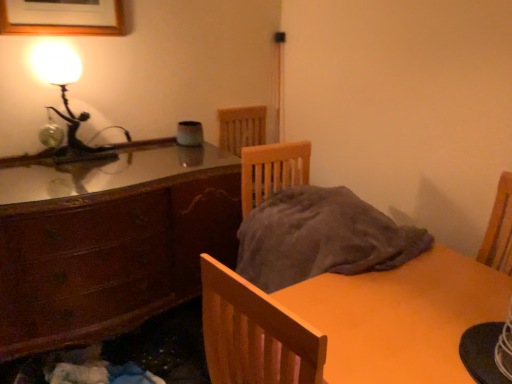
What is the approximate width of matte wooden table at lower right?

matte wooden table at lower right is 31.59 inches in width.

Locate an element on the screen. Image resolution: width=512 pixels, height=384 pixels. matte wooden table at lower right is located at coordinates (350, 323).

You are a GUI agent. You are given a task and a screenshot of the screen. Output one action in this format:
    pyautogui.click(x=<x>, y=<y>)
    Task: Click on the wooden picture frame at upper left
    
    Given the screenshot: What is the action you would take?
    pyautogui.click(x=64, y=18)

At what (x,y) coordinates should I click in order to perform the action: click on wooden cabinet at left. Please return your answer as a coordinate pair (x, y). This screenshot has height=384, width=512. Looking at the image, I should click on (109, 241).

Is matte wooden table at lower right taller than wooden picture frame at upper left?

Yes.

What's the angular difference between matte wooden table at lower right and wooden picture frame at upper left's facing directions?

The angle between the facing direction of matte wooden table at lower right and the facing direction of wooden picture frame at upper left is 89.1 degrees.

I want to click on picture frame above the matte wooden table at lower right (from the image's perspective), so coord(64,18).

Looking at this image, from the image's perspective, is matte glass lamp at upper left above or below wooden cabinet at left?

matte glass lamp at upper left is above wooden cabinet at left.

How much distance is there between matte glass lamp at upper left and wooden cabinet at left?

The distance of matte glass lamp at upper left from wooden cabinet at left is 17.94 inches.

Does point (54, 82) come behind point (194, 255)?

No, it is in front of (194, 255).

Is matte glass lamp at upper left thinner than wooden cabinet at left?

Yes.

Can wooden cabinet at left be found inside wooden picture frame at upper left?

No, wooden picture frame at upper left does not contain wooden cabinet at left.

From the image's perspective, is wooden picture frame at upper left located above or below wooden cabinet at left?

From the image's perspective, wooden picture frame at upper left appears above wooden cabinet at left.

Which object is positioned more to the left, wooden picture frame at upper left or wooden cabinet at left?

From the viewer's perspective, wooden picture frame at upper left appears more on the left side.

In terms of size, does matte glass lamp at upper left appear bigger or smaller than wooden picture frame at upper left?

In the image, matte glass lamp at upper left appears to be larger than wooden picture frame at upper left.

From a real-world perspective, is matte glass lamp at upper left above or below wooden picture frame at upper left?

In terms of real-world spatial position, matte glass lamp at upper left is below wooden picture frame at upper left.

Is wooden picture frame at upper left at the back of matte glass lamp at upper left?

That's not correct — matte glass lamp at upper left is not looking away from wooden picture frame at upper left.

In the image, is matte glass lamp at upper left on the left side or the right side of wooden picture frame at upper left?

matte glass lamp at upper left is positioned on wooden picture frame at upper left's right side.

Is wooden cabinet at left oriented away from wooden picture frame at upper left?

wooden cabinet at left does not have its back to wooden picture frame at upper left.

From the picture: From a real-world perspective, is wooden cabinet at left above or below wooden picture frame at upper left?

Clearly, from a real-world perspective, wooden cabinet at left is below wooden picture frame at upper left.

Which object is wider, wooden cabinet at left or wooden picture frame at upper left?

wooden cabinet at left.

From the image's perspective, which is below, wooden cabinet at left or wooden picture frame at upper left?

wooden cabinet at left is shown below in the image.

Are matte glass lamp at upper left and matte wooden table at lower right making contact?

No, matte glass lamp at upper left is not touching matte wooden table at lower right.

From the image's perspective, is matte glass lamp at upper left located above matte wooden table at lower right?

Yes, from the image's perspective, matte glass lamp at upper left is over matte wooden table at lower right.

Is matte glass lamp at upper left smaller than matte wooden table at lower right?

Correct, matte glass lamp at upper left occupies less space than matte wooden table at lower right.

What's the angular difference between wooden cabinet at left and matte wooden table at lower right's facing directions?

The angle between the facing direction of wooden cabinet at left and the facing direction of matte wooden table at lower right is 87.4 degrees.

Is wooden cabinet at left aimed at matte wooden table at lower right?

Yes, wooden cabinet at left faces towards matte wooden table at lower right.

Considering the positions of objects wooden cabinet at left and matte wooden table at lower right in the image provided, who is in front, wooden cabinet at left or matte wooden table at lower right?

matte wooden table at lower right is in front.

Which object is thinner, wooden cabinet at left or matte wooden table at lower right?

wooden cabinet at left is thinner.

Locate an element on the screen. The height and width of the screenshot is (384, 512). picture frame to the left of matte wooden table at lower right is located at coordinates (64, 18).

Identify the location of lamp above the wooden cabinet at left (from the image's perspective). The width and height of the screenshot is (512, 384). (67, 100).

Based on their spatial positions, is matte glass lamp at upper left or wooden cabinet at left closer to matte wooden table at lower right?

The object closer to matte wooden table at lower right is wooden cabinet at left.

Which object lies nearer to the anchor point wooden picture frame at upper left, matte wooden table at lower right or matte glass lamp at upper left?

matte glass lamp at upper left.

From the picture: Looking at the image, which one is located closer to matte glass lamp at upper left, wooden picture frame at upper left or matte wooden table at lower right?

wooden picture frame at upper left is positioned closer to the anchor matte glass lamp at upper left.

When comparing their distances from matte wooden table at lower right, does wooden picture frame at upper left or wooden cabinet at left seem further?

Among the two, wooden picture frame at upper left is located further to matte wooden table at lower right.

Considering their positions, is matte wooden table at lower right positioned closer to matte glass lamp at upper left than wooden cabinet at left?

Among the two, wooden cabinet at left is located nearer to matte glass lamp at upper left.

Which object lies nearer to the anchor point wooden cabinet at left, wooden picture frame at upper left or matte glass lamp at upper left?

matte glass lamp at upper left is positioned closer to the anchor wooden cabinet at left.

Based on the photo, looking at the image, which one is located further to wooden cabinet at left, matte glass lamp at upper left or matte wooden table at lower right?

Among the two, matte wooden table at lower right is located further to wooden cabinet at left.

When comparing their distances from matte wooden table at lower right, does wooden cabinet at left or wooden picture frame at upper left seem closer?

wooden cabinet at left lies closer to matte wooden table at lower right than the other object.

I want to click on cabinetry that lies between wooden picture frame at upper left and matte wooden table at lower right from top to bottom, so click(109, 241).

Where is `lamp between wooden picture frame at upper left and matte wooden table at lower right vertically`? lamp between wooden picture frame at upper left and matte wooden table at lower right vertically is located at coordinates (67, 100).

This screenshot has width=512, height=384. In order to click on cabinetry between matte glass lamp at upper left and matte wooden table at lower right in this screenshot , I will do `click(109, 241)`.

Locate an element on the screen. lamp that lies between wooden picture frame at upper left and wooden cabinet at left from top to bottom is located at coordinates (67, 100).